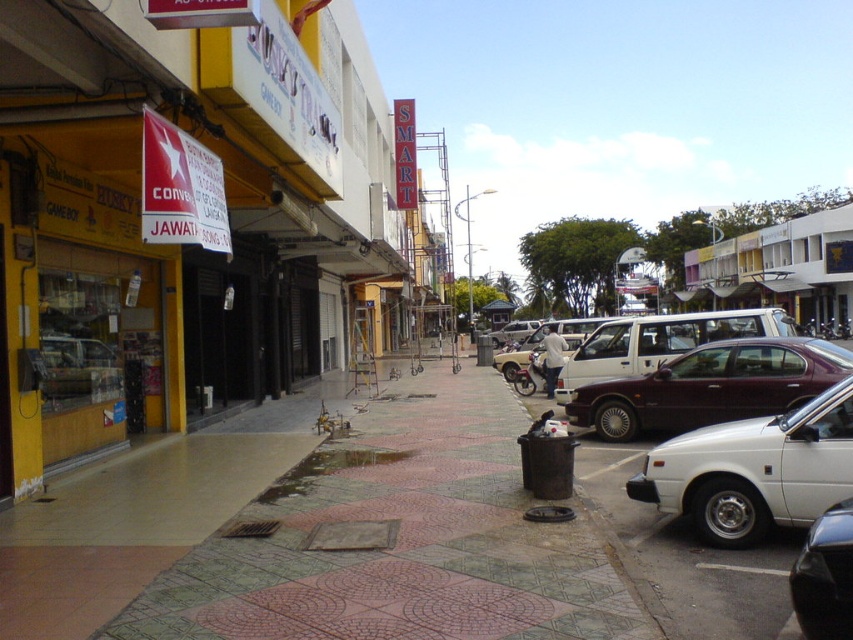
Question: Which point is farther to the camera?

Choices:
 (A) white matte van at center-right
 (B) maroon metallic car at center-right

Answer: (A)

Question: Considering the relative positions of white glossy sedan at right and white matte van at center-right in the image provided, where is white glossy sedan at right located with respect to white matte van at center-right?

Choices:
 (A) right
 (B) left

Answer: (B)

Question: Is maroon metallic car at right thinner than maroon metallic sedan at center-right?

Choices:
 (A) yes
 (B) no

Answer: (B)

Question: Is yellow matte building at center smaller than polished concrete sidewalk at center?

Choices:
 (A) no
 (B) yes

Answer: (A)

Question: Based on their relative distances, which object is nearer to the maroon metallic car at right?

Choices:
 (A) white matte van at center-right
 (B) yellow matte building at center
 (C) white glossy sedan at right

Answer: (C)

Question: Based on their relative distances, which object is farther from the maroon metallic car at right?

Choices:
 (A) white glossy sedan at right
 (B) maroon metallic sedan at center-right

Answer: (A)